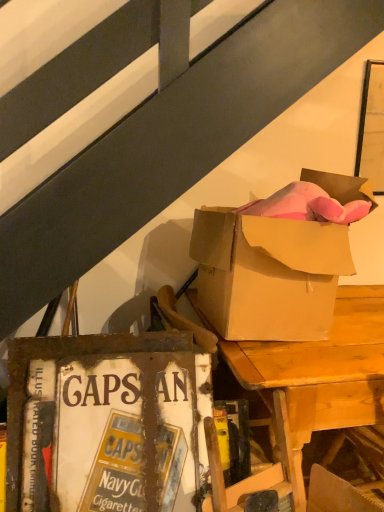
Question: Does wooden desk at upper right contain matte cardboard box at upper right?

Choices:
 (A) no
 (B) yes

Answer: (A)

Question: Can you confirm if wooden desk at upper right is positioned to the left of matte cardboard box at upper right?

Choices:
 (A) yes
 (B) no

Answer: (B)

Question: Considering the relative positions of wooden desk at upper right and matte cardboard box at upper right in the image provided, is wooden desk at upper right behind matte cardboard box at upper right?

Choices:
 (A) yes
 (B) no

Answer: (A)

Question: Is wooden desk at upper right located outside matte cardboard box at upper right?

Choices:
 (A) yes
 (B) no

Answer: (A)

Question: From a real-world perspective, is wooden desk at upper right beneath matte cardboard box at upper right?

Choices:
 (A) yes
 (B) no

Answer: (A)

Question: From the image's perspective, would you say wooden desk at upper right is shown under matte cardboard box at upper right?

Choices:
 (A) yes
 (B) no

Answer: (A)

Question: Can you confirm if rusty metal sign at lower left is positioned to the left of wooden desk at upper right?

Choices:
 (A) no
 (B) yes

Answer: (B)

Question: From a real-world perspective, does rusty metal sign at lower left sit lower than wooden desk at upper right?

Choices:
 (A) no
 (B) yes

Answer: (A)

Question: From the image's perspective, is rusty metal sign at lower left located above wooden desk at upper right?

Choices:
 (A) yes
 (B) no

Answer: (B)

Question: Is rusty metal sign at lower left further to camera compared to wooden desk at upper right?

Choices:
 (A) no
 (B) yes

Answer: (A)

Question: Could you tell me if rusty metal sign at lower left is turned towards wooden desk at upper right?

Choices:
 (A) no
 (B) yes

Answer: (A)

Question: Does rusty metal sign at lower left have a lesser height compared to wooden desk at upper right?

Choices:
 (A) no
 (B) yes

Answer: (B)

Question: Does matte cardboard box at upper right appear on the left side of wooden desk at upper right?

Choices:
 (A) yes
 (B) no

Answer: (A)